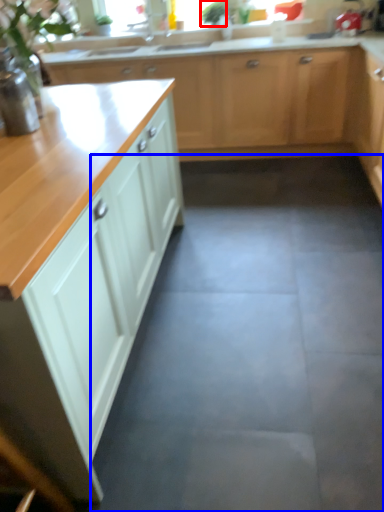
Question: Which point is further to the camera, plant (highlighted by a red box) or concrete (highlighted by a blue box)?

Choices:
 (A) plant
 (B) concrete

Answer: (A)